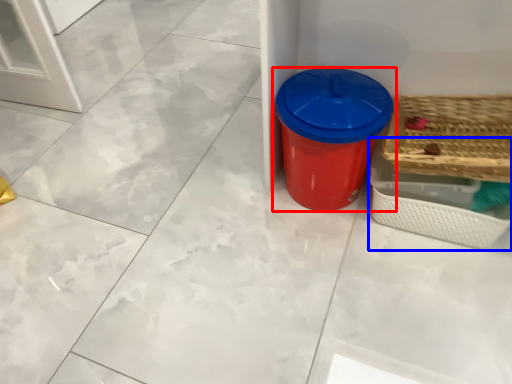
Question: Which of the following is the farthest to the observer, waste container (highlighted by a red box) or basket (highlighted by a blue box)?

Choices:
 (A) waste container
 (B) basket

Answer: (B)